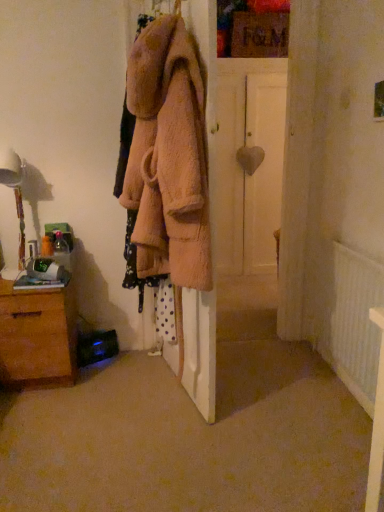
Question: In terms of height, does soft pink fuzzy coat at center look taller or shorter compared to white matte door at center?

Choices:
 (A) tall
 (B) short

Answer: (B)

Question: Considering the positions of point (163, 74) and point (223, 248), is point (163, 74) closer or farther from the camera than point (223, 248)?

Choices:
 (A) farther
 (B) closer

Answer: (B)

Question: Which object is the closest to the soft pink fuzzy coat at center?

Choices:
 (A) white textured radiator at lower right
 (B) fuzzy pink coat at upper center
 (C) brown wooden chest of drawers at lower left
 (D) white matte door at center
 (E) white glossy table lamp at left

Answer: (C)

Question: Which object is positioned closest to the white textured radiator at lower right?

Choices:
 (A) soft pink fuzzy coat at center
 (B) white glossy table lamp at left
 (C) white matte door at center
 (D) brown wooden chest of drawers at lower left
 (E) fuzzy pink coat at upper center

Answer: (A)